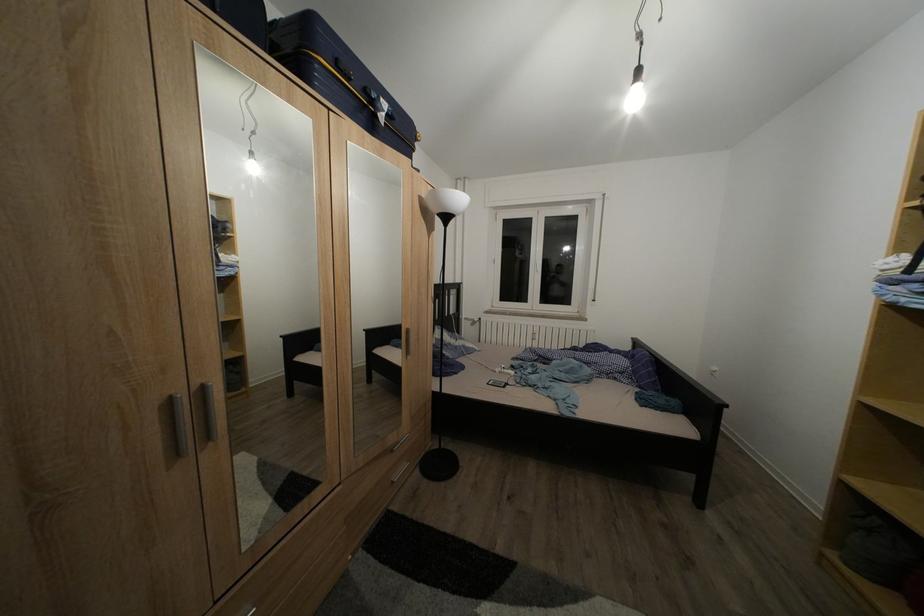
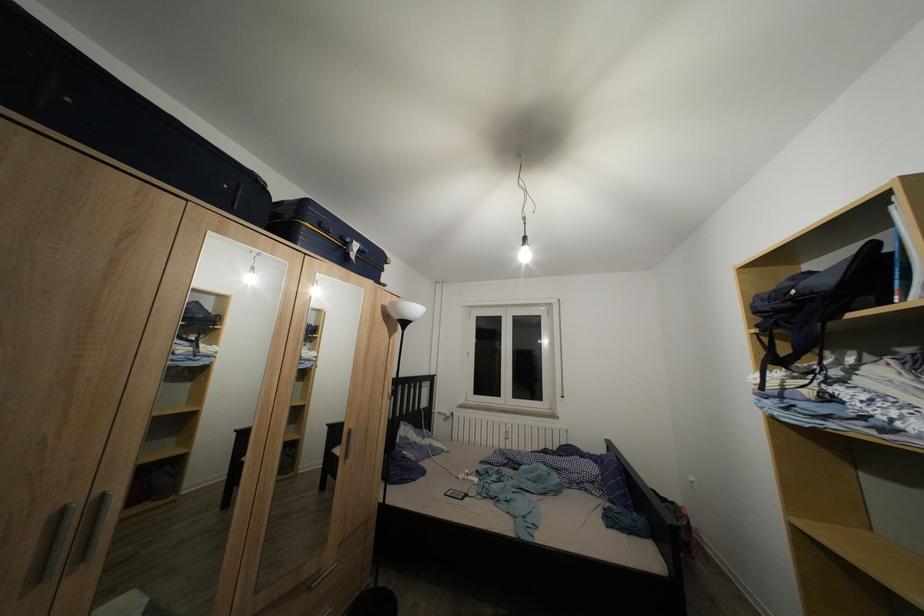
In the second image, find the point that corresponds to the point at 213,392 in the first image.

(111, 503)